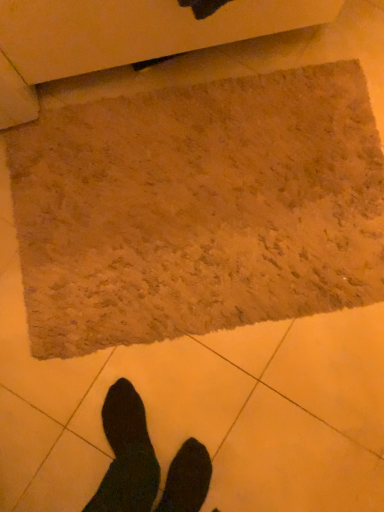
What is the approximate width of beige shaggy rug at center?

beige shaggy rug at center is 36.73 inches wide.

This screenshot has height=512, width=384. I want to click on beige shaggy rug at center, so click(x=198, y=209).

What do you see at coordinates (198, 209) in the screenshot?
I see `beige shaggy rug at center` at bounding box center [198, 209].

In order to click on beige shaggy rug at center in this screenshot , I will do `click(198, 209)`.